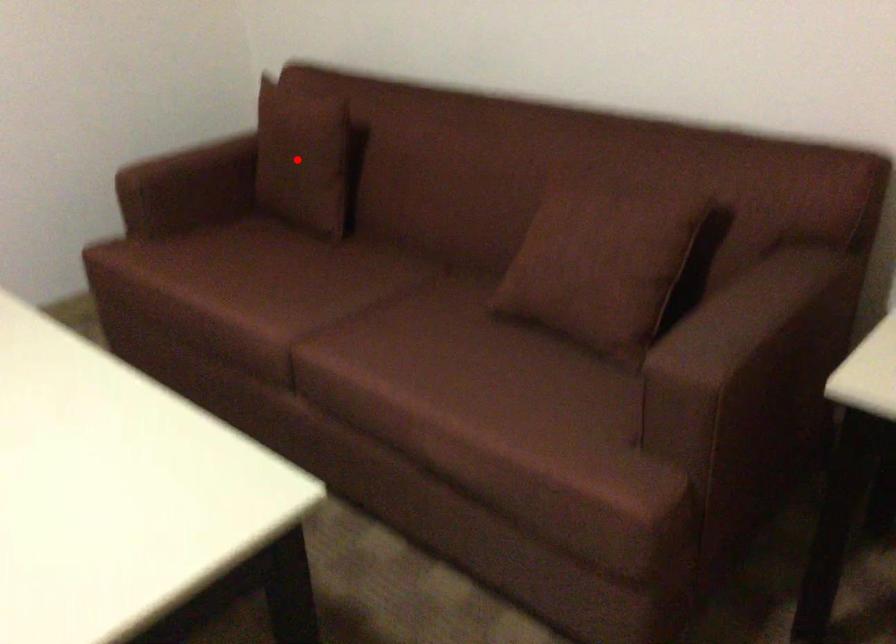
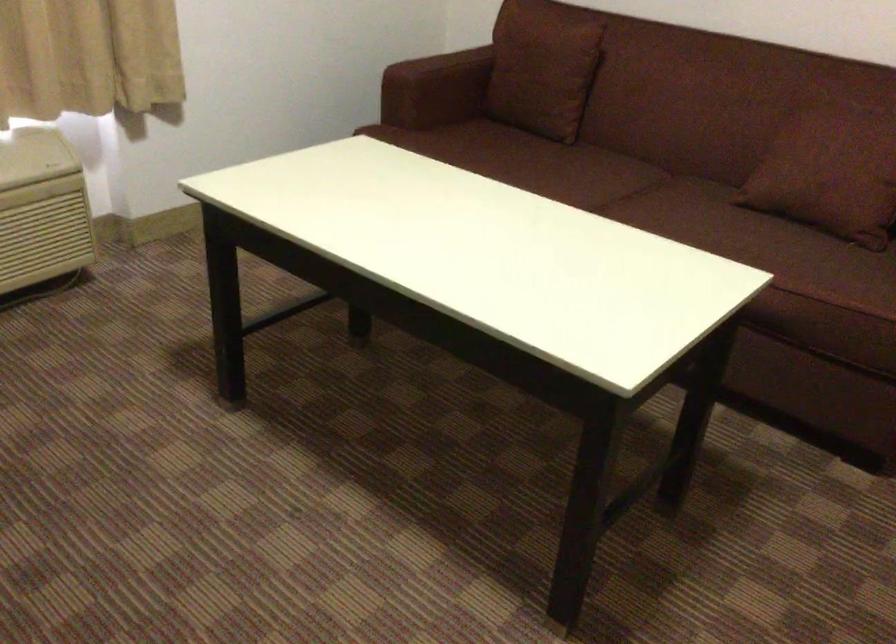
Locate, in the second image, the point that corresponds to the highlighted location in the first image.

(543, 69)